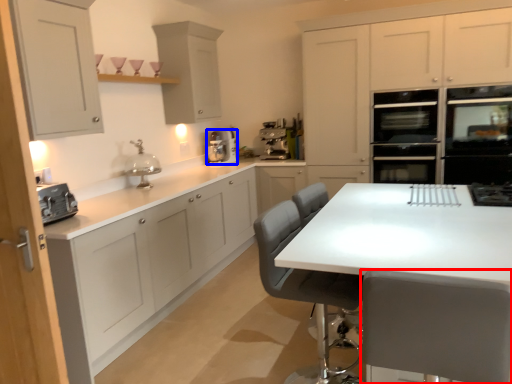
Question: Which object appears farthest to the camera in this image, chair (highlighted by a red box) or kitchen appliance (highlighted by a blue box)?

Choices:
 (A) chair
 (B) kitchen appliance

Answer: (B)